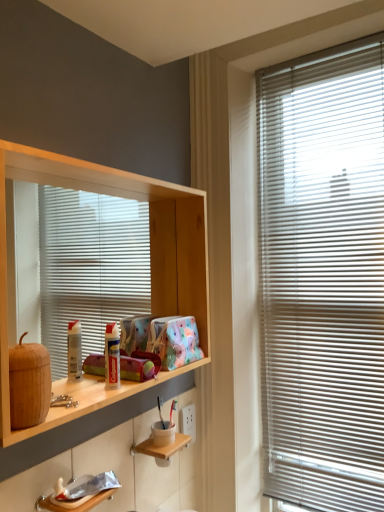
Question: Can you confirm if wooden shelf at lower center, positioned as the first shelf in bottom-to-top order, is taller than wooden shelf at left, arranged as the 2th shelf when ordered from the bottom?

Choices:
 (A) yes
 (B) no

Answer: (B)

Question: Is there a large distance between wooden shelf at lower center, positioned as the first shelf in bottom-to-top order, and wooden shelf at left, arranged as the 2th shelf when ordered from the bottom?

Choices:
 (A) yes
 (B) no

Answer: (B)

Question: From the image's perspective, is wooden shelf at lower center, which ranks as the 2th shelf in top-to-bottom order, under wooden shelf at left, arranged as the first shelf when viewed from the top?

Choices:
 (A) yes
 (B) no

Answer: (A)

Question: Can we say wooden shelf at lower center, positioned as the first shelf in bottom-to-top order, lies outside wooden shelf at left, arranged as the first shelf when viewed from the top?

Choices:
 (A) no
 (B) yes

Answer: (B)

Question: Can you confirm if wooden shelf at lower center, which ranks as the 2th shelf in top-to-bottom order, is bigger than wooden shelf at left, arranged as the 2th shelf when ordered from the bottom?

Choices:
 (A) yes
 (B) no

Answer: (B)

Question: Considering the relative positions of white plastic blinds at right and wooden shelf at lower center, positioned as the first shelf in bottom-to-top order, in the image provided, is white plastic blinds at right to the left or to the right of wooden shelf at lower center, positioned as the first shelf in bottom-to-top order,?

Choices:
 (A) left
 (B) right

Answer: (B)

Question: From a real-world perspective, is white plastic blinds at right above or below wooden shelf at lower center, positioned as the first shelf in bottom-to-top order?

Choices:
 (A) above
 (B) below

Answer: (A)

Question: From the image's perspective, is white plastic blinds at right above or below wooden shelf at lower center, positioned as the first shelf in bottom-to-top order?

Choices:
 (A) below
 (B) above

Answer: (B)

Question: Is white plastic blinds at right inside or outside of wooden shelf at lower center, positioned as the first shelf in bottom-to-top order?

Choices:
 (A) inside
 (B) outside

Answer: (B)

Question: In the image, is wooden shelf at left, arranged as the 2th shelf when ordered from the bottom, positioned in front of or behind white plastic blinds at right?

Choices:
 (A) behind
 (B) front

Answer: (B)

Question: From a real-world perspective, is wooden shelf at left, arranged as the first shelf when viewed from the top, above or below white plastic blinds at right?

Choices:
 (A) above
 (B) below

Answer: (A)

Question: Considering the positions of wooden shelf at left, arranged as the 2th shelf when ordered from the bottom, and white plastic blinds at right in the image, is wooden shelf at left, arranged as the 2th shelf when ordered from the bottom, taller or shorter than white plastic blinds at right?

Choices:
 (A) tall
 (B) short

Answer: (B)

Question: From the image's perspective, is wooden shelf at left, arranged as the 2th shelf when ordered from the bottom, above or below white plastic blinds at right?

Choices:
 (A) below
 (B) above

Answer: (B)

Question: Is wooden shelf at left, arranged as the first shelf when viewed from the top, wider or thinner than wooden shelf at lower center, which ranks as the 2th shelf in top-to-bottom order?

Choices:
 (A) thin
 (B) wide

Answer: (A)

Question: Considering the positions of point (185, 216) and point (145, 452), is point (185, 216) closer or farther from the camera than point (145, 452)?

Choices:
 (A) farther
 (B) closer

Answer: (A)